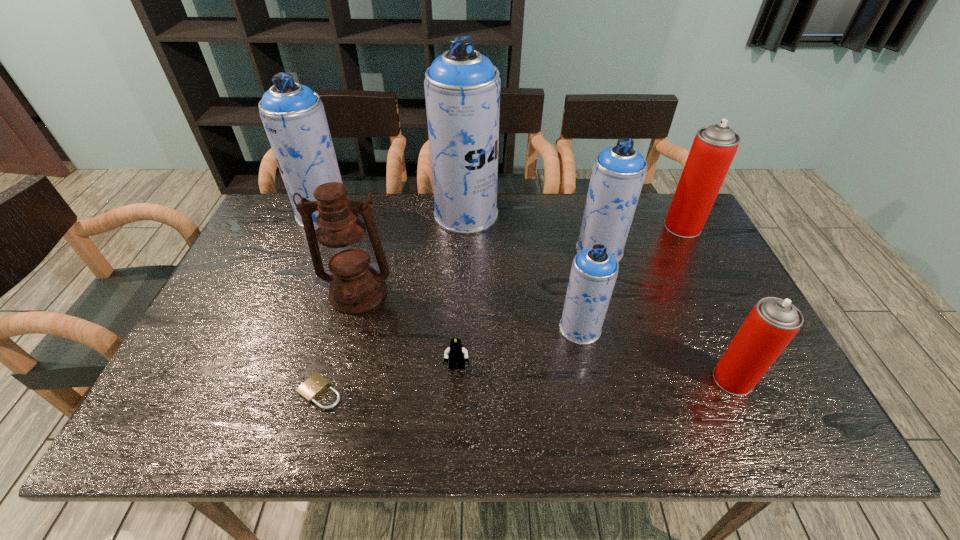
The width and height of the screenshot is (960, 540). I want to click on blank space at the left edge, so click(276, 284).

Where is `free space at the right edge`? The height and width of the screenshot is (540, 960). free space at the right edge is located at coordinates (703, 339).

Image resolution: width=960 pixels, height=540 pixels. Identify the location of free space at the far left corner of the desktop. (254, 236).

Where is `vacant space at the near left corner of the desktop`? The image size is (960, 540). vacant space at the near left corner of the desktop is located at coordinates (232, 406).

Identify the location of free location at the far right corner of the desktop. The image size is (960, 540). (650, 208).

The image size is (960, 540). I want to click on vacant region between the smaller red aerosol can and the smallest blue aerosol can, so click(x=657, y=354).

In order to click on blank region between the eighth shortest object and the nearer red aerosol can in this screenshot , I will do `click(528, 297)`.

You are a GUI agent. You are given a task and a screenshot of the screen. Output one action in this format:
    pyautogui.click(x=<x>, y=<y>)
    Task: Click on the unoccupied position between the second nearest aerosol can and the eighth tallest object
    
    Given the screenshot: What is the action you would take?
    pyautogui.click(x=518, y=348)

At what (x,y) coordinates should I click in order to perform the action: click on vacant point located between the second nearest blue aerosol can and the shortest object. Please return your answer as a coordinate pair (x, y). Looking at the image, I should click on (460, 321).

The width and height of the screenshot is (960, 540). I want to click on free area in between the nearest blue aerosol can and the oil lamp, so click(469, 310).